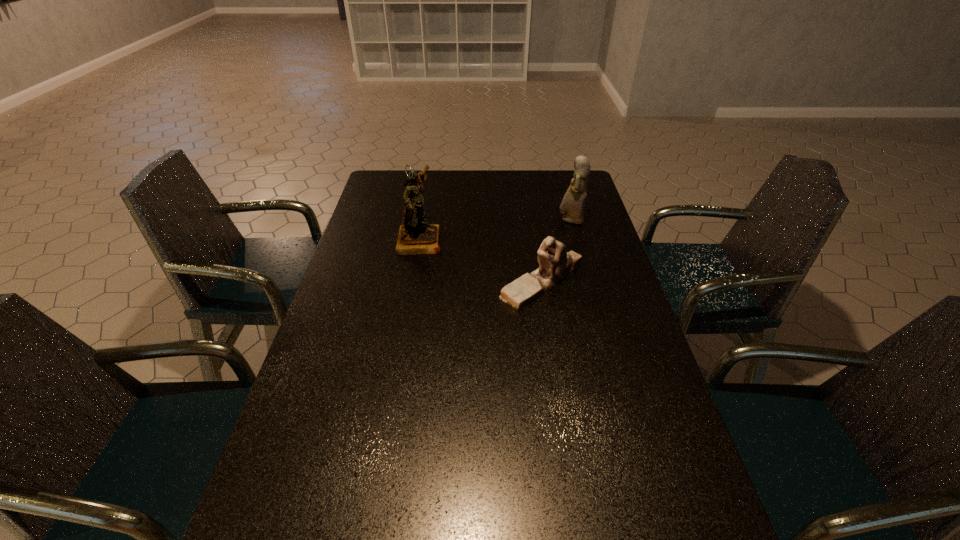
Image resolution: width=960 pixels, height=540 pixels. In the image, there is a desktop. Find the location of `free space at the right edge`. free space at the right edge is located at coordinates (596, 319).

At what (x,y) coordinates should I click in order to perform the action: click on the second closest object to the shortest figurine. Please return your answer as a coordinate pair (x, y). Looking at the image, I should click on (416, 236).

Identify which object is located as the nearest to the shortest object. Please provide its 2D coordinates. Your answer should be formatted as a tuple, i.e. [(x, y)], where the tuple contains the x and y coordinates of a point satisfying the conditions above.

[(573, 203)]

Identify which figurine is the nearest to the shortest object. Please provide its 2D coordinates. Your answer should be formatted as a tuple, i.e. [(x, y)], where the tuple contains the x and y coordinates of a point satisfying the conditions above.

[(573, 203)]

Select which figurine appears as the second closest to the leftmost object. Please provide its 2D coordinates. Your answer should be formatted as a tuple, i.e. [(x, y)], where the tuple contains the x and y coordinates of a point satisfying the conditions above.

[(573, 203)]